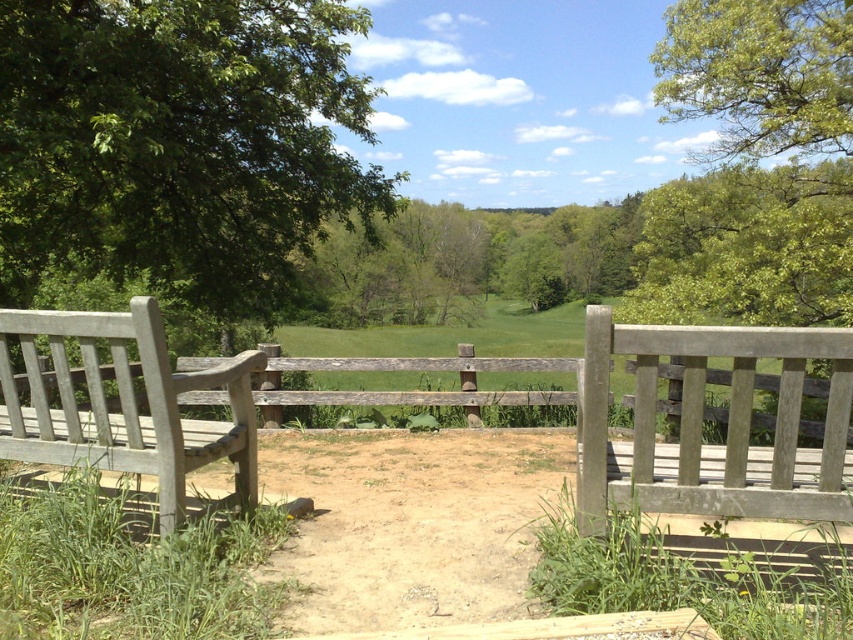
Which of these two, wooden bench at center or green leafy tree at upper right, stands shorter?

wooden bench at center is shorter.

Does wooden bench at center have a greater height compared to green leafy tree at upper right?

No, wooden bench at center is not taller than green leafy tree at upper right.

The image size is (853, 640). What do you see at coordinates (701, 422) in the screenshot? I see `wooden bench at center` at bounding box center [701, 422].

Where is `wooden bench at center`? The image size is (853, 640). wooden bench at center is located at coordinates (701, 422).

Does green leafy tree at upper left appear on the left side of green leafy tree at upper right?

Indeed, green leafy tree at upper left is positioned on the left side of green leafy tree at upper right.

Who is higher up, green leafy tree at upper left or green leafy tree at upper right?

Positioned higher is green leafy tree at upper right.

Between point (334, 54) and point (727, 113), which one is positioned behind?

The point (727, 113) is behind.

Find the location of a particular element. The width and height of the screenshot is (853, 640). green leafy tree at upper left is located at coordinates (178, 144).

Which is above, green leafy tree at upper left or wooden bench at center?

green leafy tree at upper left

Find the location of a particular element. The width and height of the screenshot is (853, 640). green leafy tree at upper left is located at coordinates (178, 144).